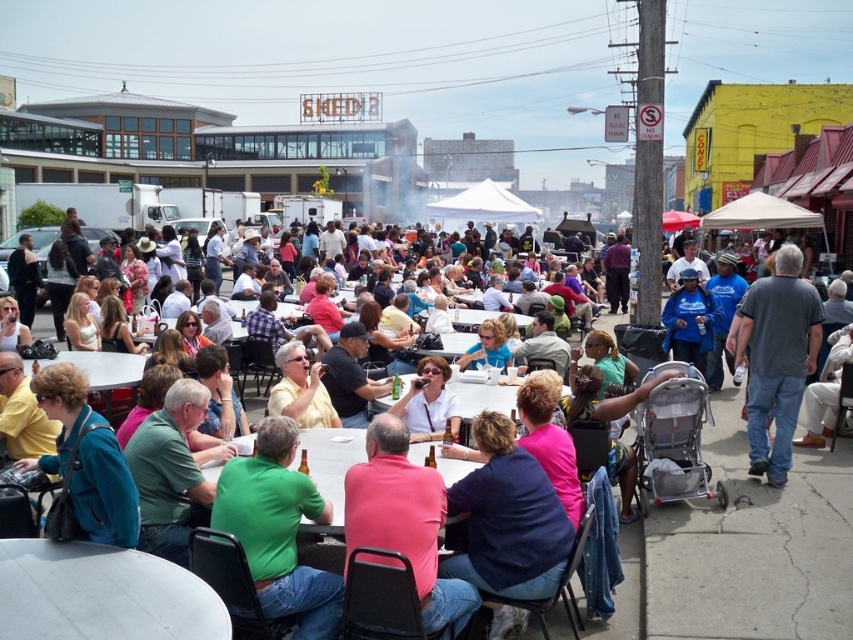
You are at the festival and need to find the teal fabric jacket at lower left. Based on the coordinates provided, where should you look relative to the stroller?

The teal fabric jacket at lower left is located at point (86, 460), which means it is positioned to the right and slightly above the stroller in the lower left area of the scene.

You are a photographer at the event and want to capture both the teal fabric jacket at lower left and the yellow matte shirt at center in a single frame. Which subject should you focus on first to ensure both are in the shot?

The teal fabric jacket at lower left is located below the yellow matte shirt at center, so you should focus on the yellow matte shirt at center first to ensure both are in the frame.